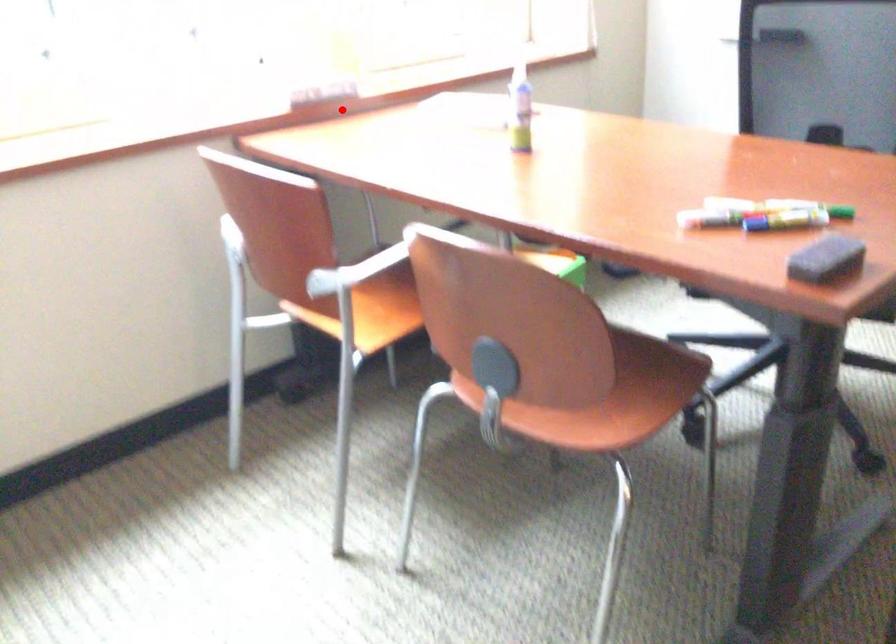
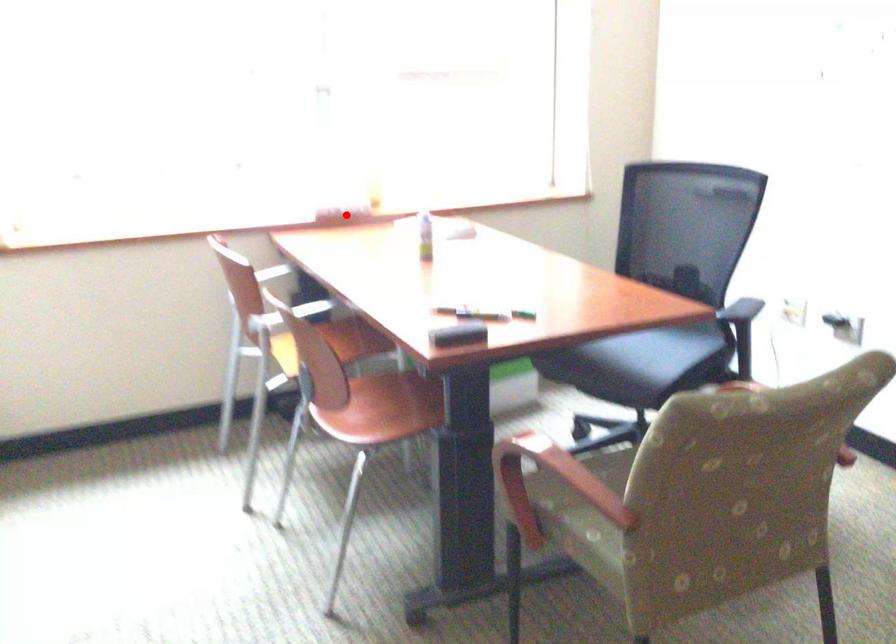
I am providing you with two images of the same scene from different viewpoints. A red point is marked on the first image and another point is marked on the second image. Do the highlighted points in image1 and image2 indicate the same real-world spot?

Yes